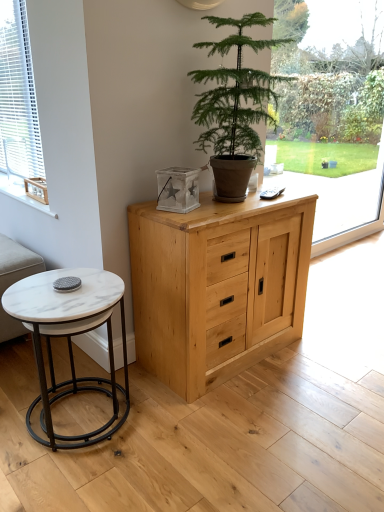
I want to click on vacant area in front of transparent glass window at center, so click(339, 300).